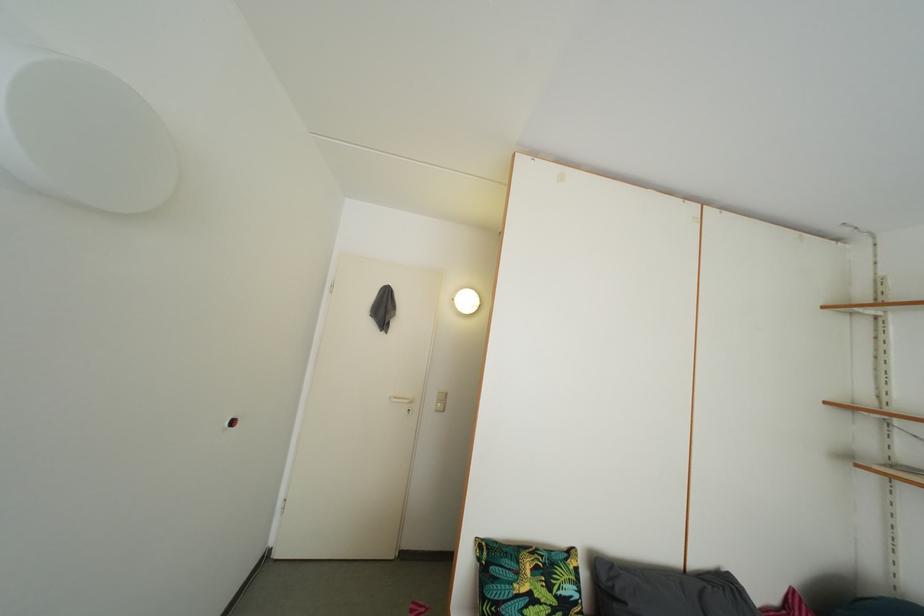
Locate an element on the screen. Image resolution: width=924 pixels, height=616 pixels. dark grey cloth is located at coordinates (665, 591).